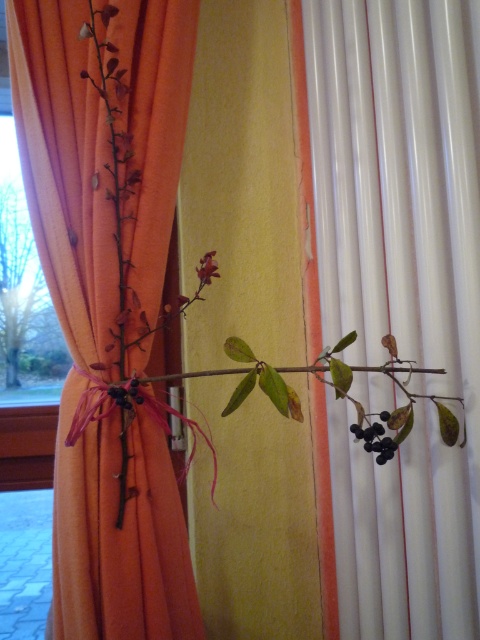
Question: Which of the following is the farthest from the observer?

Choices:
 (A) green matte branch at right
 (B) matte red flower at center
 (C) green matte branch at center

Answer: (B)

Question: Does green matte branch at right appear over matte red flower at center?

Choices:
 (A) no
 (B) yes

Answer: (A)

Question: Among these points, which one is nearest to the camera?

Choices:
 (A) (279, 368)
 (B) (453, 296)
 (C) (216, 266)

Answer: (B)

Question: Does green matte branch at right have a greater width compared to orange fabric curtain at left?

Choices:
 (A) yes
 (B) no

Answer: (B)

Question: Is green matte branch at right thinner than matte red flower at center?

Choices:
 (A) no
 (B) yes

Answer: (A)

Question: Which of these objects is positioned farthest from the matte red flower at center?

Choices:
 (A) orange fabric curtain at left
 (B) green matte branch at center

Answer: (A)